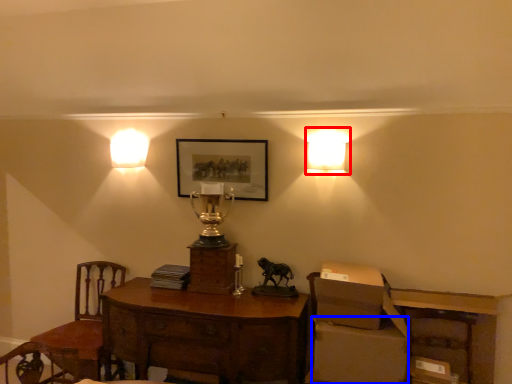
Question: Which object is closer to the camera taking this photo, lamp (highlighted by a red box) or cardboard box (highlighted by a blue box)?

Choices:
 (A) lamp
 (B) cardboard box

Answer: (B)